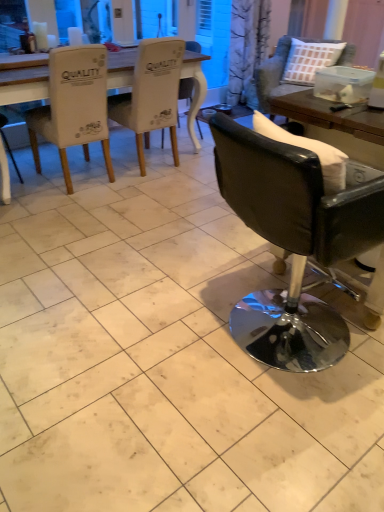
Find the location of `vacant area that lies in front of white fabric chair at upper left, arranged as the 4th chair when viewed from the right`. vacant area that lies in front of white fabric chair at upper left, arranged as the 4th chair when viewed from the right is located at coordinates (154, 192).